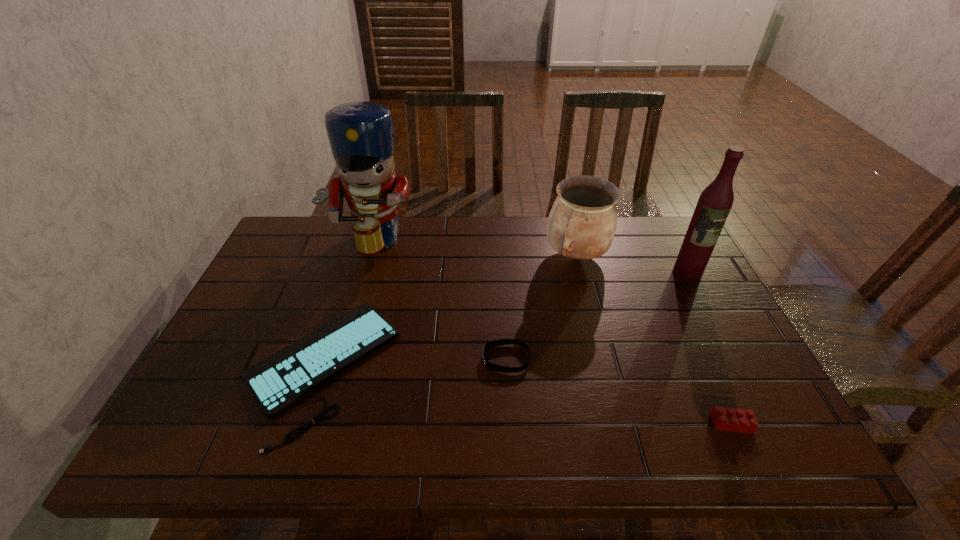
You are a GUI agent. You are given a task and a screenshot of the screen. Output one action in this format:
    pyautogui.click(x=<x>, y=<y>)
    Task: Click on the free space located 0.290m on the back of the Lego
    The height and width of the screenshot is (540, 960).
    Given the screenshot: What is the action you would take?
    pos(683,316)

Where is `free region located 0.160m on the display of the wristband`? The image size is (960, 540). free region located 0.160m on the display of the wristband is located at coordinates (417, 359).

In order to click on vacant space situated 0.060m on the display of the wristband in this screenshot , I will do `click(458, 359)`.

In order to click on vacant point located on the display of the wristband in this screenshot , I will do `click(348, 359)`.

At what (x,y) coordinates should I click in order to perform the action: click on vacant space located 0.170m on the back of the computer keyboard. Please return your answer as a coordinate pair (x, y). Looking at the image, I should click on (353, 264).

Locate an element on the screen. The image size is (960, 540). nutcracker that is at the far edge is located at coordinates (361, 136).

Image resolution: width=960 pixels, height=540 pixels. Identify the location of urn positioned at the far edge. (581, 225).

Where is `Lego present at the near edge`? This screenshot has width=960, height=540. Lego present at the near edge is located at coordinates (728, 419).

At what (x,y) coordinates should I click in order to perform the action: click on computer keyboard present at the near edge. Please return your answer as a coordinate pair (x, y). This screenshot has height=540, width=960. Looking at the image, I should click on (277, 381).

The image size is (960, 540). I want to click on nutcracker located in the left edge section of the desktop, so click(x=361, y=136).